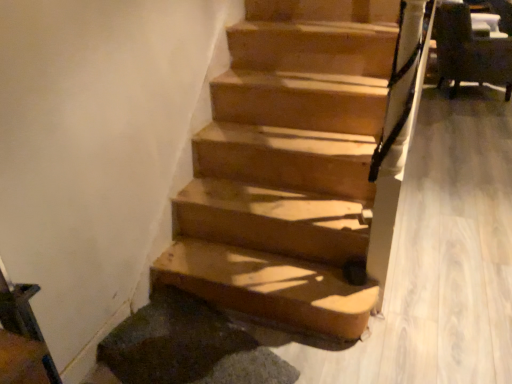
Find the location of a particular element. The image size is (512, 384). wooden stairs at center is located at coordinates (302, 166).

What do you see at coordinates (302, 166) in the screenshot? The height and width of the screenshot is (384, 512). I see `wooden stairs at center` at bounding box center [302, 166].

What do you see at coordinates (469, 51) in the screenshot? This screenshot has height=384, width=512. I see `dark brown leather armchair at upper right` at bounding box center [469, 51].

The height and width of the screenshot is (384, 512). What are the coordinates of `dark brown leather armchair at upper right` in the screenshot? It's located at (469, 51).

At what (x,y) coordinates should I click in order to perform the action: click on wooden stairs at center. Please return your answer as a coordinate pair (x, y). The width and height of the screenshot is (512, 384). Looking at the image, I should click on (302, 166).

Based on the photo, which object is positioned more to the right, wooden stairs at center or dark brown leather armchair at upper right?

dark brown leather armchair at upper right.

Is wooden stairs at center positioned behind dark brown leather armchair at upper right?

No.

Which is closer to the camera, (381,260) or (452,6)?

Point (381,260).

From the image's perspective, which one is positioned lower, wooden stairs at center or dark brown leather armchair at upper right?

From the image's view, wooden stairs at center is below.

In the scene shown: From a real-world perspective, which is physically below, wooden stairs at center or dark brown leather armchair at upper right?

wooden stairs at center is physically lower.

In terms of width, does wooden stairs at center look wider or thinner when compared to dark brown leather armchair at upper right?

Clearly, wooden stairs at center has more width compared to dark brown leather armchair at upper right.

Can you confirm if wooden stairs at center is shorter than dark brown leather armchair at upper right?

Indeed, wooden stairs at center has a lesser height compared to dark brown leather armchair at upper right.

Considering the sizes of objects wooden stairs at center and dark brown leather armchair at upper right in the image provided, who is smaller, wooden stairs at center or dark brown leather armchair at upper right?

With smaller size is dark brown leather armchair at upper right.

Is wooden stairs at center positioned beyond the bounds of dark brown leather armchair at upper right?

wooden stairs at center is positioned outside dark brown leather armchair at upper right.

Is wooden stairs at center not near dark brown leather armchair at upper right?

wooden stairs at center is positioned a significant distance from dark brown leather armchair at upper right.

Is wooden stairs at center oriented away from dark brown leather armchair at upper right?

No, wooden stairs at center's orientation is not away from dark brown leather armchair at upper right.

Measure the distance between wooden stairs at center and dark brown leather armchair at upper right.

wooden stairs at center and dark brown leather armchair at upper right are 8.50 feet apart.

Find the location of a particular element. stairs below the dark brown leather armchair at upper right (from the image's perspective) is located at coordinates (302, 166).

Considering the relative positions of dark brown leather armchair at upper right and wooden stairs at center in the image provided, is dark brown leather armchair at upper right to the left or to the right of wooden stairs at center?

dark brown leather armchair at upper right is positioned on wooden stairs at center's right side.

Which is in front, dark brown leather armchair at upper right or wooden stairs at center?

Positioned in front is wooden stairs at center.

Does point (459, 38) come farther from viewer compared to point (350, 231)?

Yes, it is.

From the image's perspective, which one is positioned higher, dark brown leather armchair at upper right or wooden stairs at center?

dark brown leather armchair at upper right, from the image's perspective.

From a real-world perspective, who is located higher, dark brown leather armchair at upper right or wooden stairs at center?

dark brown leather armchair at upper right is physically above.

Can you confirm if dark brown leather armchair at upper right is wider than wooden stairs at center?

No, dark brown leather armchair at upper right is not wider than wooden stairs at center.

Which of these two, dark brown leather armchair at upper right or wooden stairs at center, stands shorter?

With less height is wooden stairs at center.

Between dark brown leather armchair at upper right and wooden stairs at center, which one has larger size?

wooden stairs at center is bigger.

Could wooden stairs at center be considered to be inside dark brown leather armchair at upper right?

No, dark brown leather armchair at upper right does not contain wooden stairs at center.

Are dark brown leather armchair at upper right and wooden stairs at center making contact?

dark brown leather armchair at upper right and wooden stairs at center are clearly separated.

Looking at this image, does dark brown leather armchair at upper right turn towards wooden stairs at center?

No, dark brown leather armchair at upper right is not aimed at wooden stairs at center.

You are a GUI agent. You are given a task and a screenshot of the screen. Output one action in this format:
    pyautogui.click(x=<x>, y=<y>)
    Task: Click on the armchair behind the wooden stairs at center
    Image resolution: width=512 pixels, height=384 pixels.
    Given the screenshot: What is the action you would take?
    pyautogui.click(x=469, y=51)

You are a GUI agent. You are given a task and a screenshot of the screen. Output one action in this format:
    pyautogui.click(x=<x>, y=<y>)
    Task: Click on the armchair that is behind the wooden stairs at center
    This screenshot has height=384, width=512.
    Given the screenshot: What is the action you would take?
    pyautogui.click(x=469, y=51)

Identify the location of armchair on the right of wooden stairs at center. (469, 51).